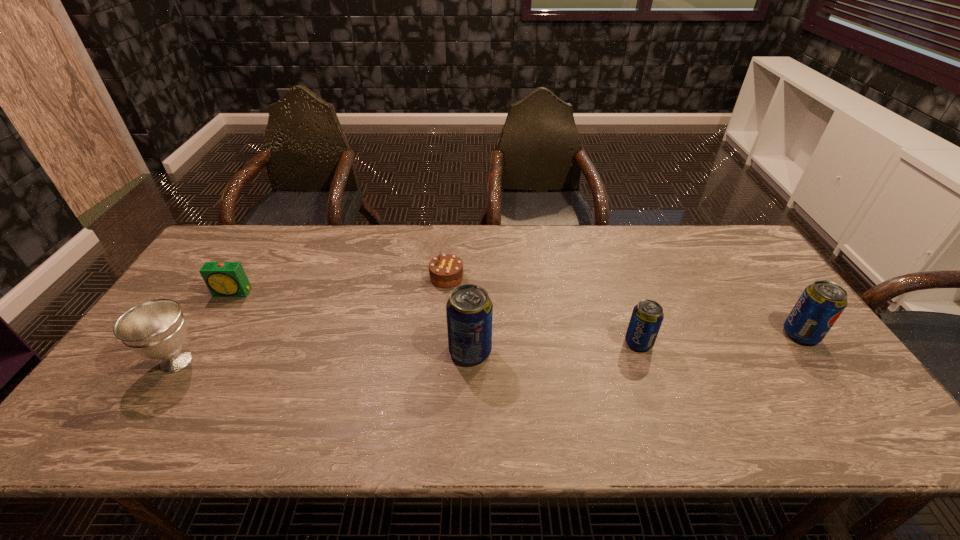
This screenshot has width=960, height=540. I want to click on object that is at the near left corner, so click(156, 329).

The width and height of the screenshot is (960, 540). In the image, there is a desktop. What are the coordinates of `vacant region at the far edge` in the screenshot? It's located at click(545, 240).

In the image, there is a desktop. Find the location of `vacant space at the near edge`. vacant space at the near edge is located at coordinates [x=381, y=380].

Find the location of a particular element. This screenshot has height=540, width=960. blank space at the left edge of the desktop is located at coordinates (198, 322).

Locate an element on the screen. free space at the right edge is located at coordinates (749, 269).

Image resolution: width=960 pixels, height=540 pixels. I want to click on vacant space at the far left corner of the desktop, so click(218, 256).

In the image, there is a desktop. At what (x,y) coordinates should I click in order to perform the action: click on vacant region at the near left corner. Please return your answer as a coordinate pair (x, y). This screenshot has width=960, height=540. Looking at the image, I should click on (154, 398).

Find the location of a particular element. The width and height of the screenshot is (960, 540). vacant region at the far right corner of the desktop is located at coordinates (729, 241).

At what (x,y) coordinates should I click in order to perform the action: click on free point between the tallest object and the alarm clock. Please return your answer as a coordinate pair (x, y). The image size is (960, 540). Looking at the image, I should click on (351, 322).

Locate an element on the screen. vacant space that is in between the third shortest object and the rightmost soda is located at coordinates (720, 338).